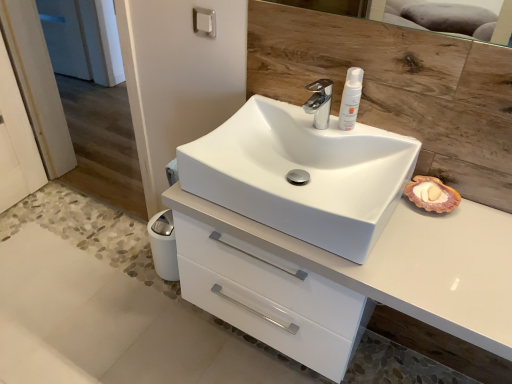
Question: Would you say chrome metallic faucet at center is to the left or to the right of white glossy sink at center in the picture?

Choices:
 (A) right
 (B) left

Answer: (A)

Question: Is point (327, 102) positioned closer to the camera than point (402, 137)?

Choices:
 (A) closer
 (B) farther

Answer: (B)

Question: Which object is positioned closest to the white glossy sink at center?

Choices:
 (A) chrome metallic faucet at center
 (B) satin nickel towel bar at upper center
 (C) white glossy cabinet at center
 (D) white matte lotion at upper center

Answer: (C)

Question: Which object is the farthest from the white glossy cabinet at center?

Choices:
 (A) white glossy sink at center
 (B) satin nickel towel bar at upper center
 (C) chrome metallic faucet at center
 (D) white matte lotion at upper center

Answer: (B)